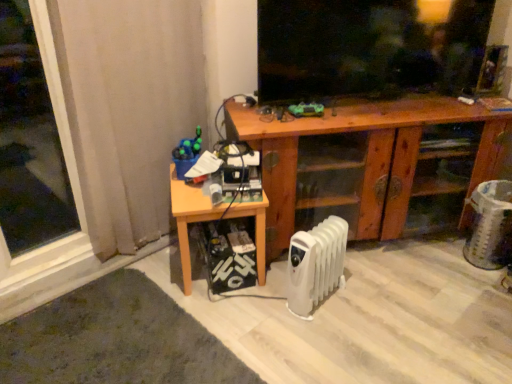
Find the location of a particular element. free point below beige fabric curtain at left (from a real-world perspective) is located at coordinates (147, 244).